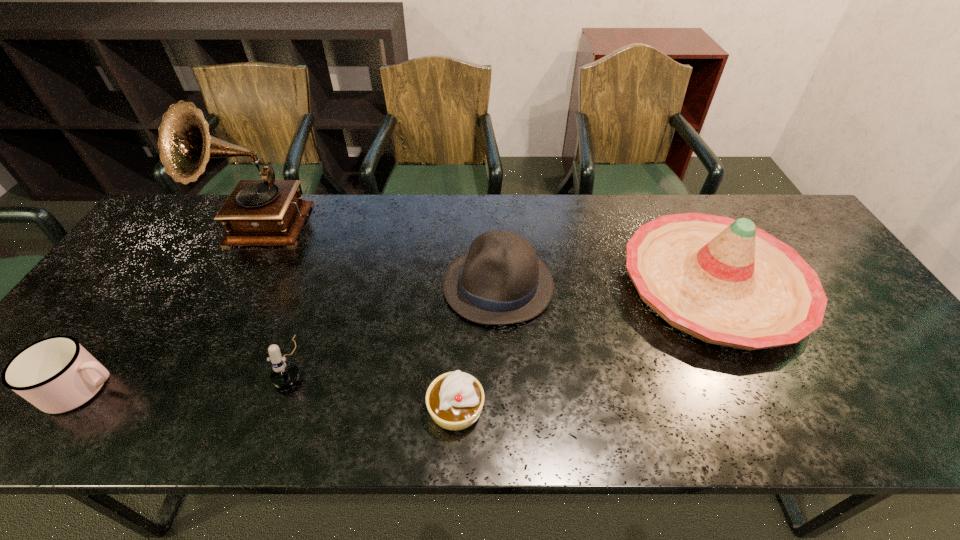
You are a GUI agent. You are given a task and a screenshot of the screen. Output one action in this format:
    pyautogui.click(x=<x>, y=<y>)
    Task: Click on the free space located 0.110m on the front-facing side of the bowler hat
    
    Given the screenshot: What is the action you would take?
    pyautogui.click(x=402, y=285)

Locate an element on the screen. free space located 0.380m on the front-facing side of the bowler hat is located at coordinates (302, 285).

Where is `free space located on the front of the fourth object from right to left`? Image resolution: width=960 pixels, height=540 pixels. free space located on the front of the fourth object from right to left is located at coordinates (276, 413).

Locate an element on the screen. free space located 0.240m on the side of the mug with the handle is located at coordinates (231, 388).

The height and width of the screenshot is (540, 960). Identify the location of free space located 0.320m on the right of the whipped cream. (634, 408).

Find the location of a particular element. The width and height of the screenshot is (960, 540). record player that is at the far edge is located at coordinates (268, 212).

The height and width of the screenshot is (540, 960). Find the location of `sombrero positioned at the far edge`. sombrero positioned at the far edge is located at coordinates (724, 281).

The height and width of the screenshot is (540, 960). What are the coordinates of `mug that is positioned at the near edge` in the screenshot? It's located at (56, 374).

Locate an element on the screen. The width and height of the screenshot is (960, 540). whipped cream present at the near edge is located at coordinates (454, 400).

Find the location of a particular element. Image resolution: width=960 pixels, height=540 pixels. object at the left edge is located at coordinates pyautogui.click(x=56, y=374).